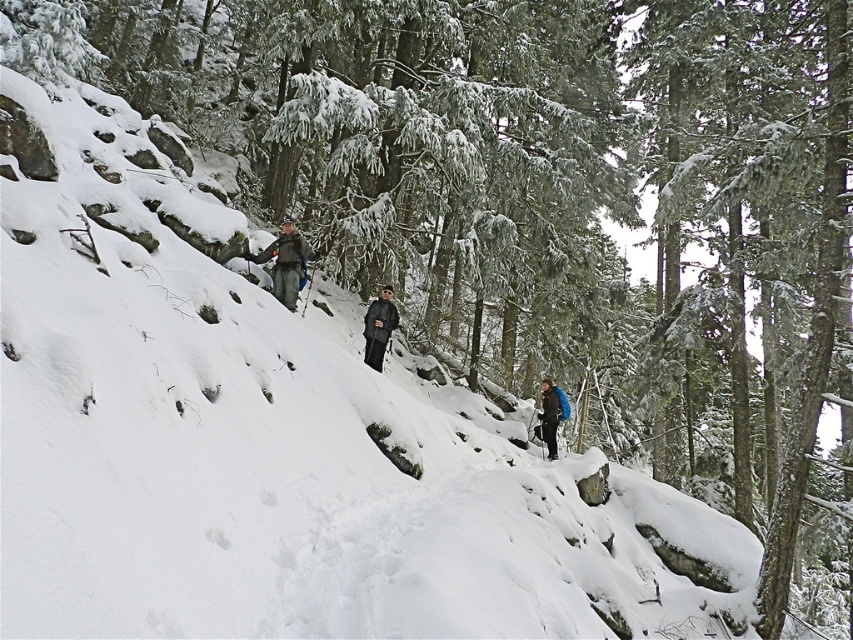
Between camouflage jacket at center and dark gray fabric jacket at center, which one appears on the right side from the viewer's perspective?

dark gray fabric jacket at center is more to the right.

Consider the image. Does camouflage jacket at center have a greater height compared to dark gray fabric jacket at center?

Indeed, camouflage jacket at center has a greater height compared to dark gray fabric jacket at center.

Which is behind, point (294, 275) or point (387, 301)?

Positioned behind is point (387, 301).

You are a GUI agent. You are given a task and a screenshot of the screen. Output one action in this format:
    pyautogui.click(x=<x>, y=<y>)
    Task: Click on the camouflage jacket at center
    This screenshot has height=640, width=853.
    Given the screenshot: What is the action you would take?
    285,262

Is dark gray fabric jacket at center closer to the viewer compared to blue fabric backpack at right?

Yes, dark gray fabric jacket at center is in front of blue fabric backpack at right.

Can you confirm if dark gray fabric jacket at center is positioned to the right of blue fabric backpack at right?

No, dark gray fabric jacket at center is not to the right of blue fabric backpack at right.

Locate an element on the screen. This screenshot has height=640, width=853. dark gray fabric jacket at center is located at coordinates (378, 326).

Find the location of `dark gray fabric jacket at center`. dark gray fabric jacket at center is located at coordinates (378, 326).

Consider the image. Can you confirm if camouflage jacket at center is thinner than blue fabric backpack at right?

No.

Between point (289, 252) and point (548, 410), which one is positioned in front?

Point (289, 252) is more forward.

Image resolution: width=853 pixels, height=640 pixels. In order to click on camouflage jacket at center in this screenshot , I will do `click(285, 262)`.